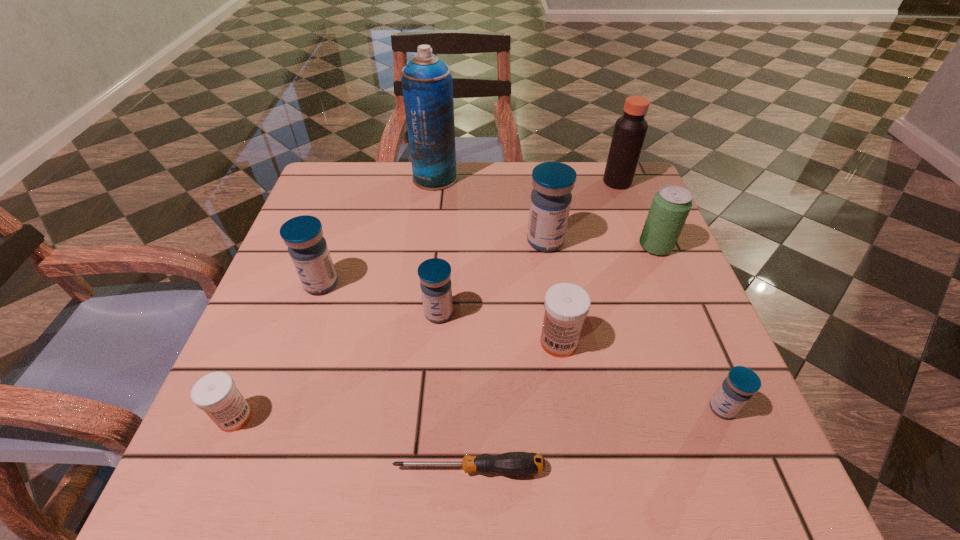
Locate which object ranks fifth in proximity to the third biggest blue medicine. Please provide its 2D coordinates. Your answer should be formatted as a tuple, i.e. [(x, y)], where the tuple contains the x and y coordinates of a point satisfying the conditions above.

[(216, 394)]

What are the coordinates of `the second closest medicine to the aerosol can` in the screenshot? It's located at (303, 235).

Identify which medicine is the nearest to the soda. Please provide its 2D coordinates. Your answer should be formatted as a tuple, i.e. [(x, y)], where the tuple contains the x and y coordinates of a point satisfying the conditions above.

[(551, 198)]

This screenshot has height=540, width=960. What are the coordinates of `blue medicine that is the closest to the second blue medicine from right to left` in the screenshot? It's located at (435, 273).

Locate which blue medicine ranks fourth in proximity to the aerosol can. Please provide its 2D coordinates. Your answer should be formatted as a tuple, i.e. [(x, y)], where the tuple contains the x and y coordinates of a point satisfying the conditions above.

[(741, 383)]

You are a GUI agent. You are given a task and a screenshot of the screen. Output one action in this format:
    pyautogui.click(x=<x>, y=<y>)
    Task: Click on the free space that satisfies the following two spatial constraints: 1. on the back side of the seventh farthest object; 2. on the left side of the nearest object
    The height and width of the screenshot is (540, 960).
    Given the screenshot: What is the action you would take?
    pyautogui.click(x=471, y=342)

The image size is (960, 540). Find the location of `free space that satisfies the following two spatial constraints: 1. on the back side of the rightmost blue medicine; 2. on the left side of the nearest object`. free space that satisfies the following two spatial constraints: 1. on the back side of the rightmost blue medicine; 2. on the left side of the nearest object is located at coordinates point(470,408).